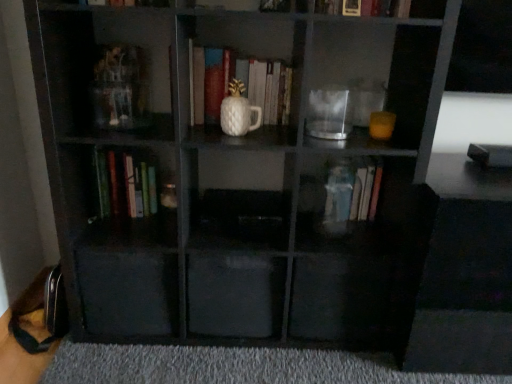
Identify the location of free spot below gray carpet at lower center (from a real-world perspective). This screenshot has height=384, width=512. (243, 368).